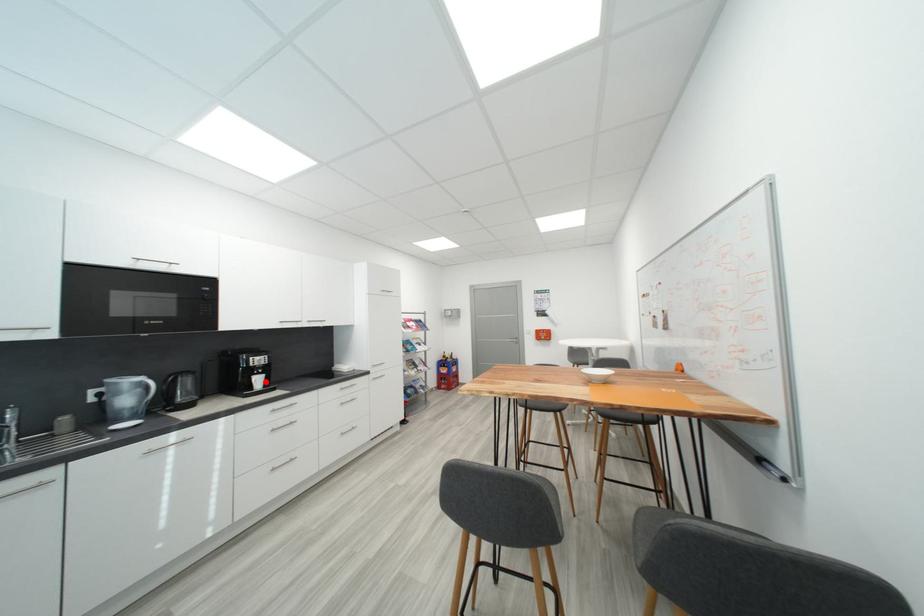
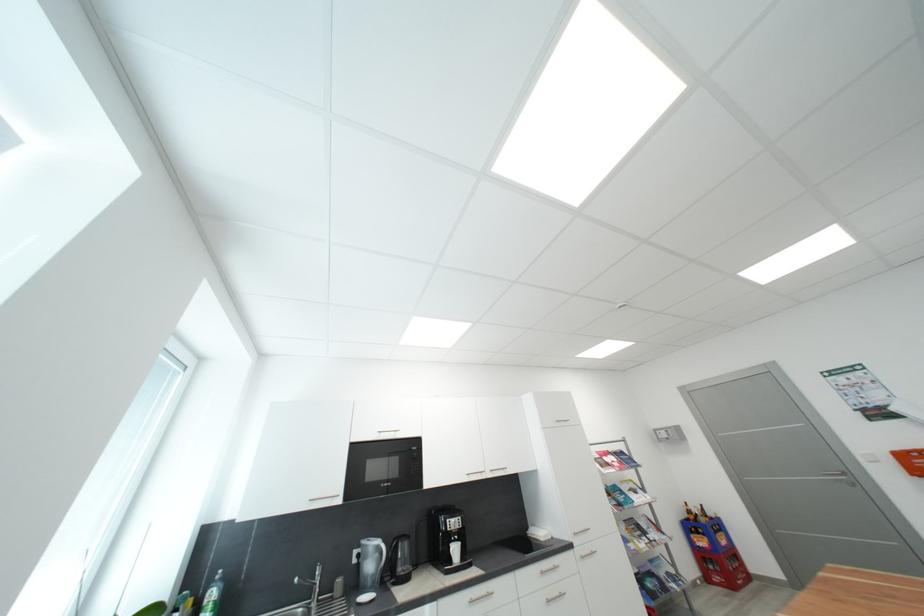
Locate, in the second image, the point that corresponds to the highlighted location in the first image.

(463, 552)